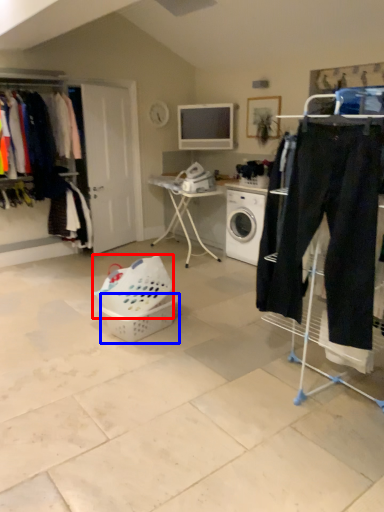
Question: Which of the following is the closest to the observer, basket (highlighted by a red box) or basket (highlighted by a blue box)?

Choices:
 (A) basket
 (B) basket

Answer: (A)